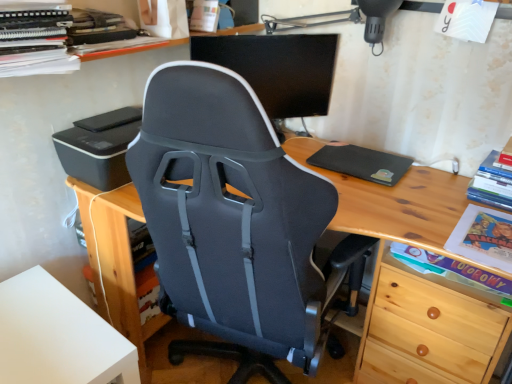
Question: Is black plastic printer at left at the back of matte cardboard book at lower right, placed as the 1th book when sorted from bottom to top?

Choices:
 (A) no
 (B) yes

Answer: (A)

Question: Is matte cardboard book at lower right, the second book in the right-to-left sequence, oriented towards black plastic printer at left?

Choices:
 (A) yes
 (B) no

Answer: (B)

Question: Does matte cardboard book at lower right, the second book in the right-to-left sequence, have a lesser width compared to black plastic printer at left?

Choices:
 (A) no
 (B) yes

Answer: (B)

Question: Considering the relative positions of matte cardboard book at lower right, which is the 3th book from top to bottom, and black plastic printer at left in the image provided, is matte cardboard book at lower right, which is the 3th book from top to bottom, to the left of black plastic printer at left from the viewer's perspective?

Choices:
 (A) no
 (B) yes

Answer: (A)

Question: From the image's perspective, does matte cardboard book at lower right, which is the 3th book from top to bottom, appear lower than black plastic printer at left?

Choices:
 (A) no
 (B) yes

Answer: (B)

Question: Considering the relative sizes of matte cardboard book at lower right, placed as the 1th book when sorted from bottom to top, and black plastic printer at left in the image provided, is matte cardboard book at lower right, placed as the 1th book when sorted from bottom to top, taller than black plastic printer at left?

Choices:
 (A) yes
 (B) no

Answer: (B)

Question: From a real-world perspective, is white matte table at lower left located beneath black matte/black rubberized mousepad at right?

Choices:
 (A) no
 (B) yes

Answer: (B)

Question: From the image's perspective, is white matte table at lower left above black matte/black rubberized mousepad at right?

Choices:
 (A) yes
 (B) no

Answer: (B)

Question: Is white matte table at lower left closer to camera compared to black matte/black rubberized mousepad at right?

Choices:
 (A) yes
 (B) no

Answer: (A)

Question: Is white matte table at lower left outside black matte/black rubberized mousepad at right?

Choices:
 (A) no
 (B) yes

Answer: (B)

Question: Does white matte table at lower left lie behind black matte/black rubberized mousepad at right?

Choices:
 (A) no
 (B) yes

Answer: (A)

Question: Could black matte/black rubberized mousepad at right be considered to be inside white matte table at lower left?

Choices:
 (A) yes
 (B) no

Answer: (B)

Question: Does orange spiral-bound book at upper left, the first book from the top, turn towards wooden desk at center?

Choices:
 (A) yes
 (B) no

Answer: (B)